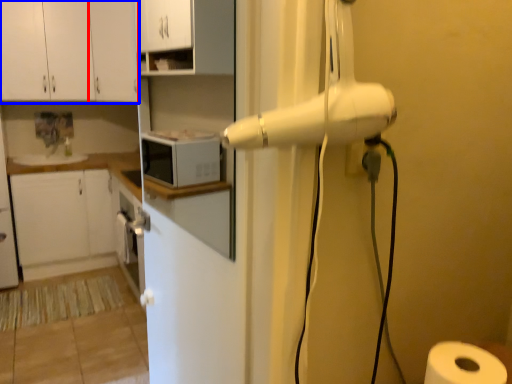
Question: Which object is closer to the camera taking this photo, cabinetry (highlighted by a red box) or cabinetry (highlighted by a blue box)?

Choices:
 (A) cabinetry
 (B) cabinetry

Answer: (B)